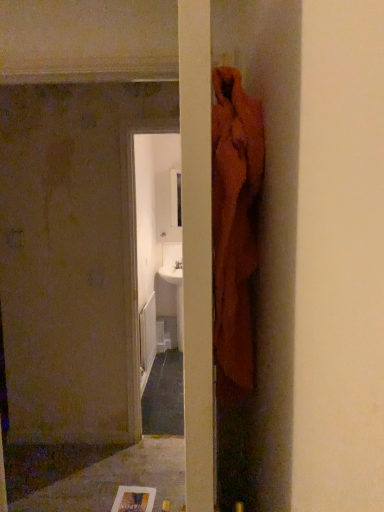
Question: From a real-world perspective, is smooth gray concrete at lower left located beneath white glossy sink at center?

Choices:
 (A) yes
 (B) no

Answer: (A)

Question: Can you confirm if smooth gray concrete at lower left is bigger than white glossy sink at center?

Choices:
 (A) yes
 (B) no

Answer: (B)

Question: Does smooth gray concrete at lower left come behind white glossy sink at center?

Choices:
 (A) no
 (B) yes

Answer: (A)

Question: Does smooth gray concrete at lower left appear on the left side of white glossy sink at center?

Choices:
 (A) yes
 (B) no

Answer: (A)

Question: Does smooth gray concrete at lower left appear on the right side of white glossy sink at center?

Choices:
 (A) yes
 (B) no

Answer: (B)

Question: Could you tell me if smooth gray concrete at lower left is facing white glossy sink at center?

Choices:
 (A) yes
 (B) no

Answer: (B)

Question: Can you confirm if white glossy sink at center is bigger than smooth gray concrete at lower left?

Choices:
 (A) yes
 (B) no

Answer: (A)

Question: Is white glossy sink at center directly adjacent to smooth gray concrete at lower left?

Choices:
 (A) no
 (B) yes

Answer: (A)

Question: Is white glossy sink at center in front of smooth gray concrete at lower left?

Choices:
 (A) yes
 (B) no

Answer: (B)

Question: Does white glossy sink at center have a greater width compared to smooth gray concrete at lower left?

Choices:
 (A) no
 (B) yes

Answer: (A)

Question: Are white glossy sink at center and smooth gray concrete at lower left far apart?

Choices:
 (A) no
 (B) yes

Answer: (B)

Question: Is smooth gray concrete at lower left inside white glossy sink at center?

Choices:
 (A) no
 (B) yes

Answer: (A)

Question: In the image, is white glossy sink at center positioned in front of or behind smooth gray concrete at lower left?

Choices:
 (A) behind
 (B) front

Answer: (A)